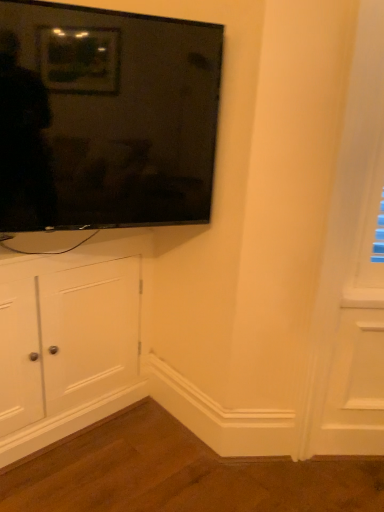
Question: Would you say flat screen tv at upper left is a long distance from white wood cabinet at left?

Choices:
 (A) yes
 (B) no

Answer: (B)

Question: Is flat screen tv at upper left facing away from white wood cabinet at left?

Choices:
 (A) yes
 (B) no

Answer: (B)

Question: Can white wood cabinet at left be found inside flat screen tv at upper left?

Choices:
 (A) yes
 (B) no

Answer: (B)

Question: Is flat screen tv at upper left facing towards white wood cabinet at left?

Choices:
 (A) yes
 (B) no

Answer: (B)

Question: Does flat screen tv at upper left appear on the right side of white wood cabinet at left?

Choices:
 (A) yes
 (B) no

Answer: (A)

Question: Considering the relative sizes of flat screen tv at upper left and white wood cabinet at left in the image provided, is flat screen tv at upper left wider than white wood cabinet at left?

Choices:
 (A) yes
 (B) no

Answer: (B)

Question: Does white wood cabinet at left have a greater width compared to flat screen tv at upper left?

Choices:
 (A) yes
 (B) no

Answer: (A)

Question: Does white wood cabinet at left appear on the left side of flat screen tv at upper left?

Choices:
 (A) yes
 (B) no

Answer: (A)

Question: Is white wood cabinet at left not within flat screen tv at upper left?

Choices:
 (A) yes
 (B) no

Answer: (A)

Question: From the image's perspective, is white wood cabinet at left on top of flat screen tv at upper left?

Choices:
 (A) no
 (B) yes

Answer: (A)

Question: Is white wood cabinet at left far from flat screen tv at upper left?

Choices:
 (A) yes
 (B) no

Answer: (B)

Question: Is white wood cabinet at left behind flat screen tv at upper left?

Choices:
 (A) no
 (B) yes

Answer: (B)

Question: Does point (122, 179) appear closer or farther from the camera than point (89, 330)?

Choices:
 (A) closer
 (B) farther

Answer: (A)